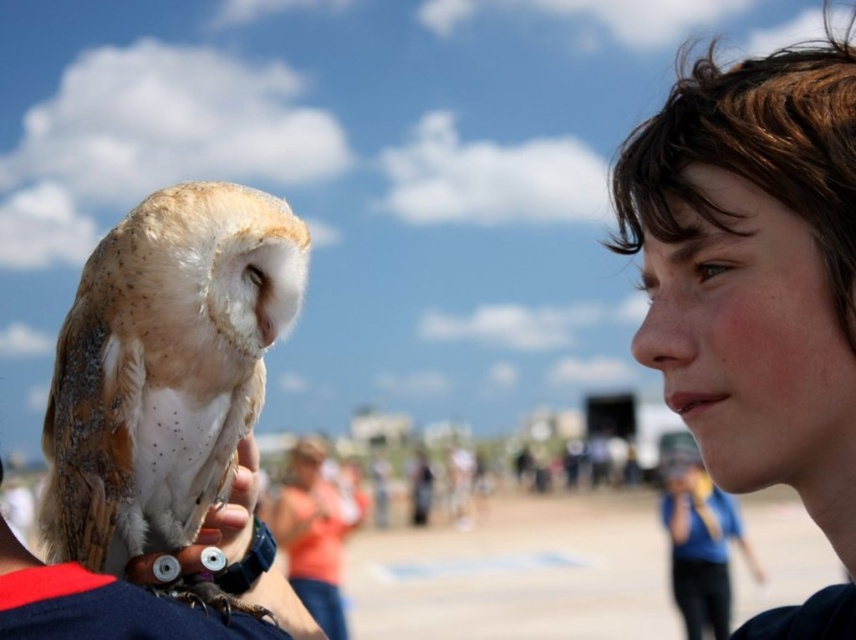
Question: Does speckled feathered owl at left have a lesser width compared to blurred orange shirt at center?

Choices:
 (A) yes
 (B) no

Answer: (A)

Question: Can you confirm if speckled feathered owl at left is smaller than blurred orange shirt at center?

Choices:
 (A) yes
 (B) no

Answer: (A)

Question: Which object is closer to the camera taking this photo?

Choices:
 (A) blurred orange shirt at center
 (B) speckled feathered owl at left

Answer: (B)

Question: Which object appears closest to the camera in this image?

Choices:
 (A) blurred orange shirt at center
 (B) speckled feathered owl at left

Answer: (B)

Question: Does speckled feathered owl at left lie behind blurred orange shirt at center?

Choices:
 (A) yes
 (B) no

Answer: (B)